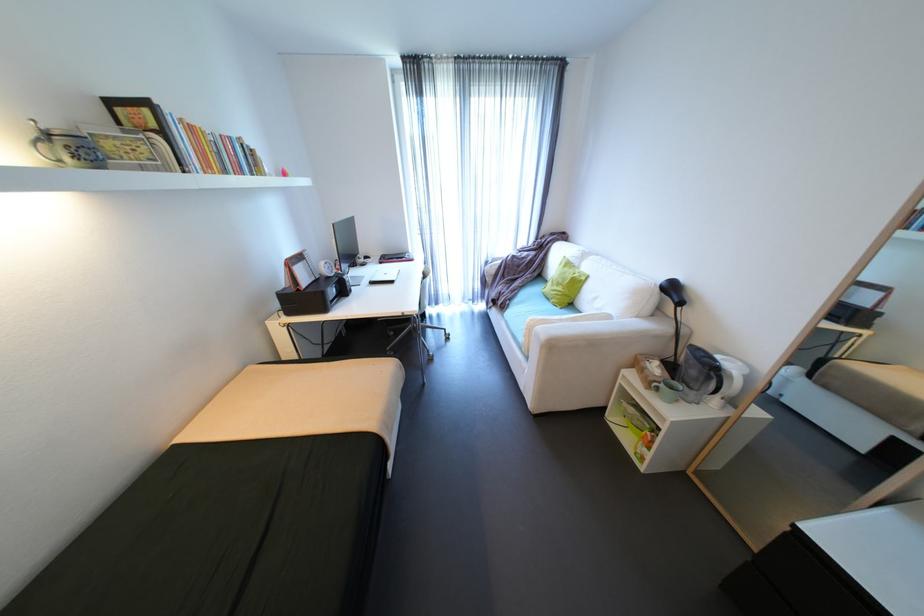
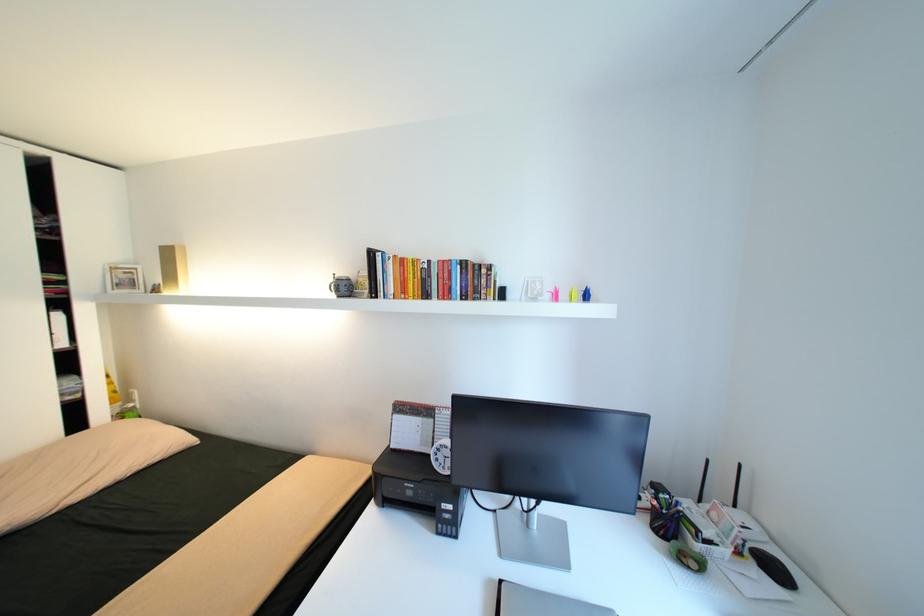
Where in the second image is the point corresponding to the point at 311,254 from the first image?

(444, 411)